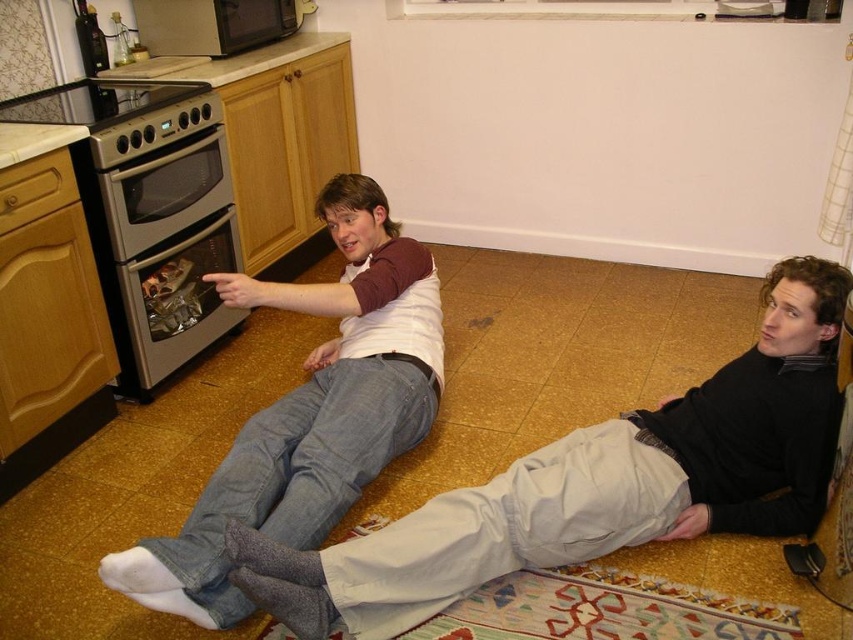
Question: Which is nearer to the denim jeans at left?

Choices:
 (A) black matte microwave at upper left
 (B) light gray cotton pants at lower center
 (C) satin silver oven at left

Answer: (B)

Question: Considering the relative positions of satin silver oven at left and black matte microwave at upper left in the image provided, where is satin silver oven at left located with respect to black matte microwave at upper left?

Choices:
 (A) right
 (B) left

Answer: (B)

Question: Which object is closer to the camera taking this photo?

Choices:
 (A) light gray cotton pants at lower center
 (B) denim jeans at left

Answer: (A)

Question: Which point is farther to the camera?

Choices:
 (A) (177, 36)
 (B) (171, 337)
 (C) (741, 528)

Answer: (A)

Question: Is light gray cotton pants at lower center thinner than black matte microwave at upper left?

Choices:
 (A) yes
 (B) no

Answer: (B)

Question: Can you confirm if light gray cotton pants at lower center is positioned below satin silver oven at left?

Choices:
 (A) yes
 (B) no

Answer: (A)